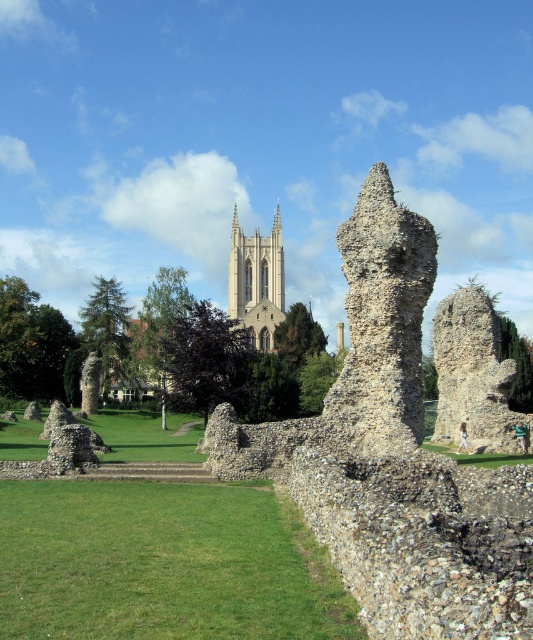
You are a tourist visiting the ancient ruins and want to take a photo of both the rustic stone sculpture at center and the rustic stone tower at center. Which object should you stand to the left of to ensure both are in the frame?

You should stand to the left of the rustic stone sculpture at center because it is positioned to the left of the rustic stone tower at center, so placing yourself to its left will keep both in view.

Based on the scene description, where is the rustic stone ruins at center located in terms of its 2D coordinates?

The rustic stone ruins at center are located at the 2D coordinates point (x=393, y=458).